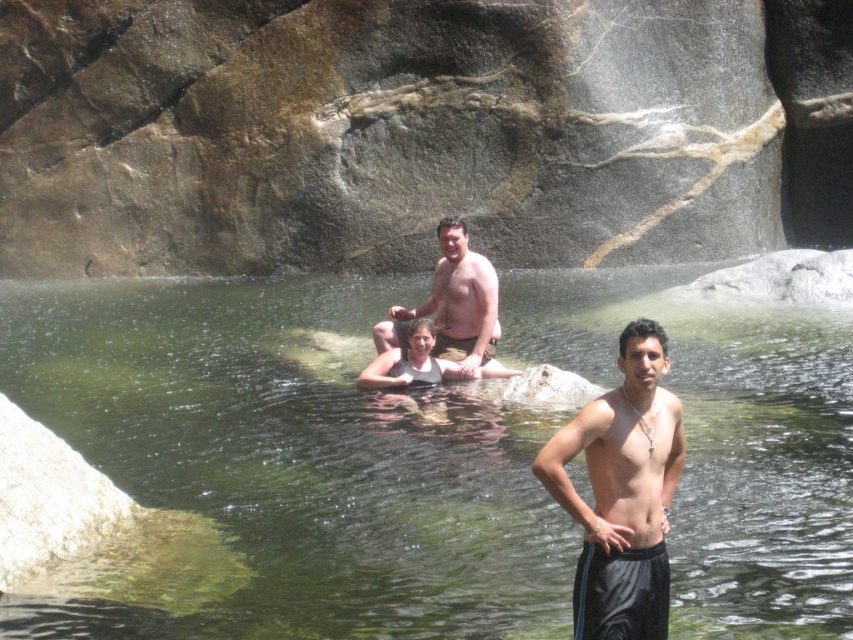
You are a photographer positioned at the edge of the pool. You want to take a photo that includes both the clear water at center and the shiny black shorts at center. Which object will appear closer to you in the photo?

The clear water at center will appear closer to you in the photo because it is further to the viewer than the shiny black shorts at center.

You are a photographer trying to capture the reflection of the smooth tan skin at center in the clear water at center. Based on the scene description, where should you position yourself to ensure the reflection is visible?

The clear water at center is positioned on the right side of smooth tan skin at center. To capture the reflection, position yourself to the right of the smooth tan skin at center so that the clear water at center can reflect its image.